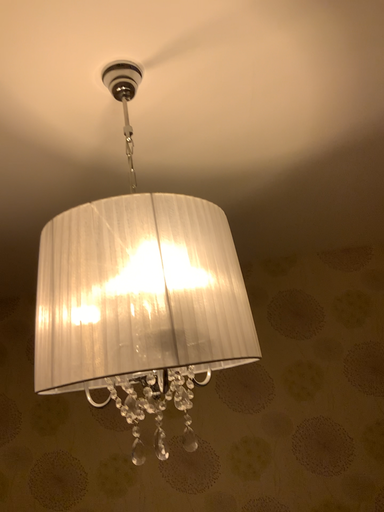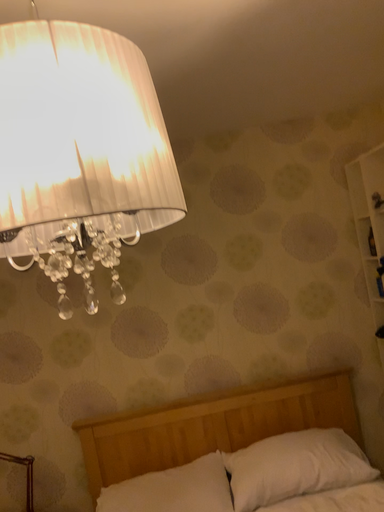
Question: Which way did the camera rotate in the video?

Choices:
 (A) rotated left
 (B) rotated right

Answer: (B)